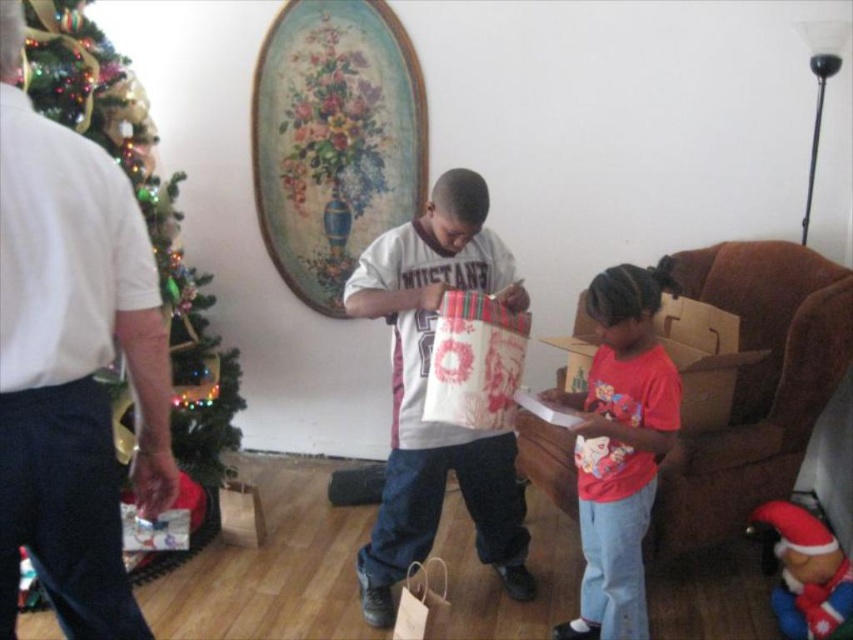
You are a photographer trying to capture a photo of the decorated green christmas tree at left and the red cotton shirt at center. Since you want to emphasize the tree, which object should you focus on first and why?

You should focus on the decorated green christmas tree at left first because it is larger in size than the red cotton shirt at center, making it the more prominent subject.

You are standing in the room and want to place a small decoration between the two points labeled point [189,401] and point [624,528]. Based on their positions, which point should the decoration be closer to in order to be centrally located between them?

To place the decoration centrally between point [189,401] and point [624,528], it should be closer to point [624,528] since point [189,401] is behind it.